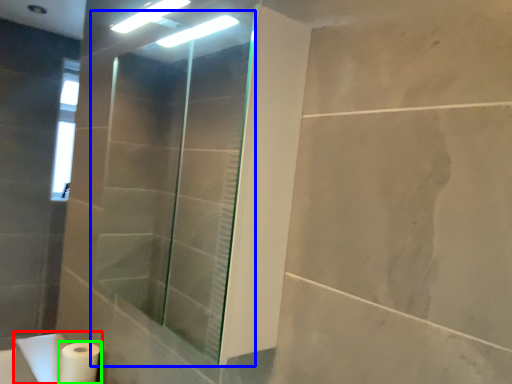
Question: Estimate the real-world distances between objects in this image. Which object is farther from sink (highlighted by a red box), shower door (highlighted by a blue box) or toilet paper (highlighted by a green box)?

Choices:
 (A) shower door
 (B) toilet paper

Answer: (A)